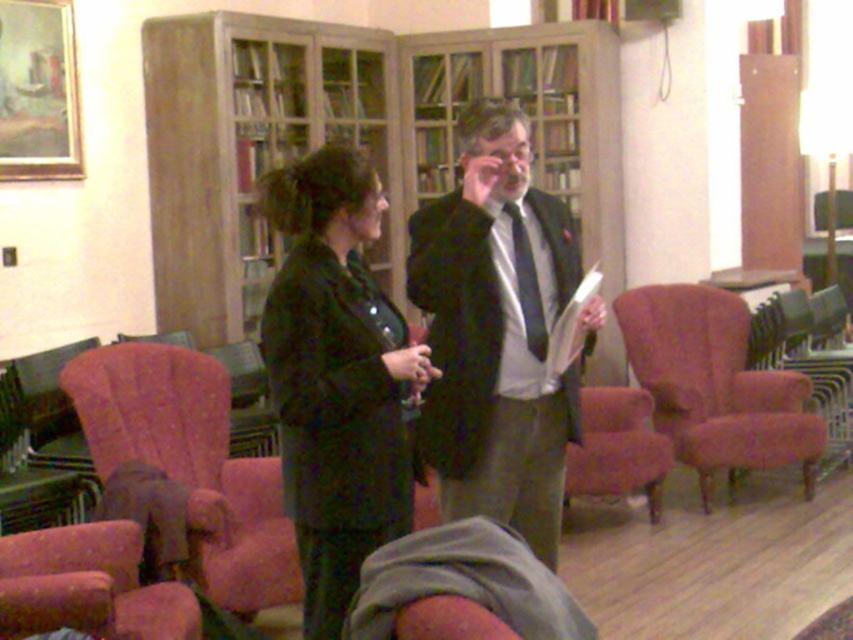
Question: Where is velvet pink armchair at lower left located in relation to velvet pink armchair at center in the image?

Choices:
 (A) right
 (B) left

Answer: (B)

Question: Does matte black jacket at center appear over velvet pink armchair at left?

Choices:
 (A) yes
 (B) no

Answer: (A)

Question: Which point is closer to the camera taking this photo?

Choices:
 (A) (595, 472)
 (B) (724, 316)
 (C) (463, 211)
 (D) (30, 540)

Answer: (C)

Question: Which point is closer to the camera?

Choices:
 (A) (27, 568)
 (B) (624, 412)

Answer: (A)

Question: Which of the following is the closest to the observer?

Choices:
 (A) matte black jacket at center
 (B) velvet pink armchair at left

Answer: (A)

Question: Does velvet pink armchair at right have a lesser width compared to velvet pink armchair at lower left?

Choices:
 (A) no
 (B) yes

Answer: (A)